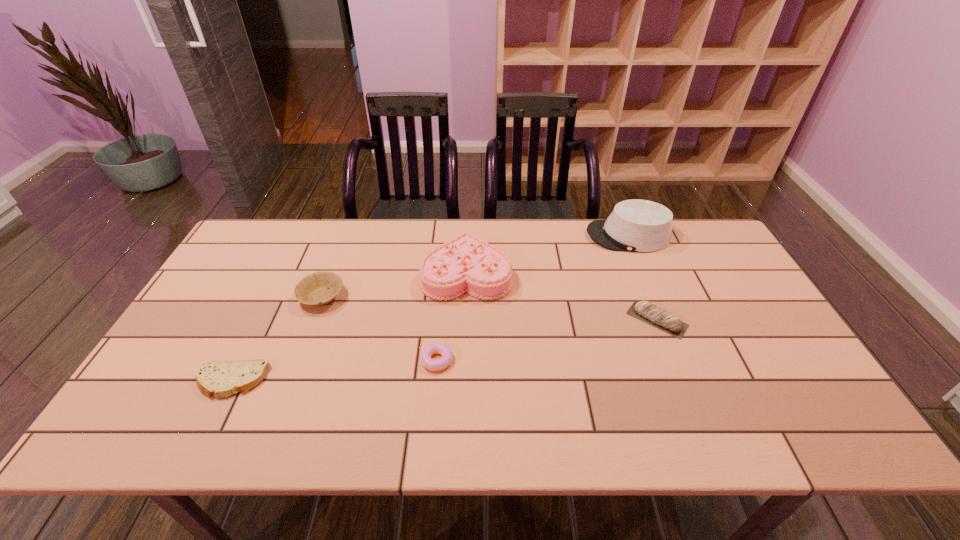
Find the location of `hat`. hat is located at coordinates (635, 225).

In order to click on the second tallest object in this screenshot , I will do pos(465,264).

Locate an element on the screen. This screenshot has width=960, height=540. bowl is located at coordinates (x=320, y=288).

Where is `the right pita bread`? The height and width of the screenshot is (540, 960). the right pita bread is located at coordinates (659, 318).

The width and height of the screenshot is (960, 540). Identify the location of the taller pita bread. (659, 318).

You are a GUI agent. You are given a task and a screenshot of the screen. Output one action in this format:
    pyautogui.click(x=<x>, y=<y>)
    Task: Click on the doughnut
    
    Given the screenshot: What is the action you would take?
    pyautogui.click(x=434, y=348)

This screenshot has height=540, width=960. What are the coordinates of `the shorter pita bread` in the screenshot? It's located at (215, 378).

Locate an element on the screen. The height and width of the screenshot is (540, 960). the left pita bread is located at coordinates (215, 378).

The width and height of the screenshot is (960, 540). What are the coordinates of `vacant region located on the front-facing side of the hat` in the screenshot? It's located at (513, 235).

Locate an element on the screen. The width and height of the screenshot is (960, 540). vacant space located on the front-facing side of the hat is located at coordinates (540, 235).